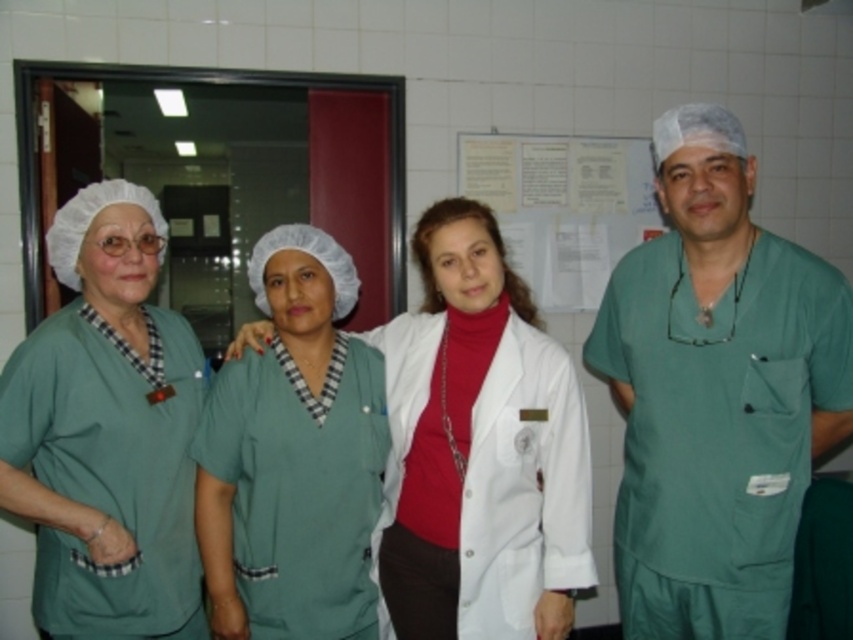
Question: Can you confirm if matte green scrubs at left is bigger than white paper at upper center?

Choices:
 (A) no
 (B) yes

Answer: (B)

Question: Is white matte lab coat at center thinner than white paper at upper center?

Choices:
 (A) no
 (B) yes

Answer: (B)

Question: Which of these objects is positioned closest to the green scrubs at center?

Choices:
 (A) white paper at upper center
 (B) white matte lab coat at center

Answer: (B)

Question: Does green scrubs at right appear under white paper at upper center?

Choices:
 (A) yes
 (B) no

Answer: (A)

Question: Among these points, which one is farthest from the camera?

Choices:
 (A) (347, 355)
 (B) (666, 141)

Answer: (A)

Question: Which object is farther from the camera taking this photo?

Choices:
 (A) white matte lab coat at center
 (B) white paper at upper center

Answer: (B)